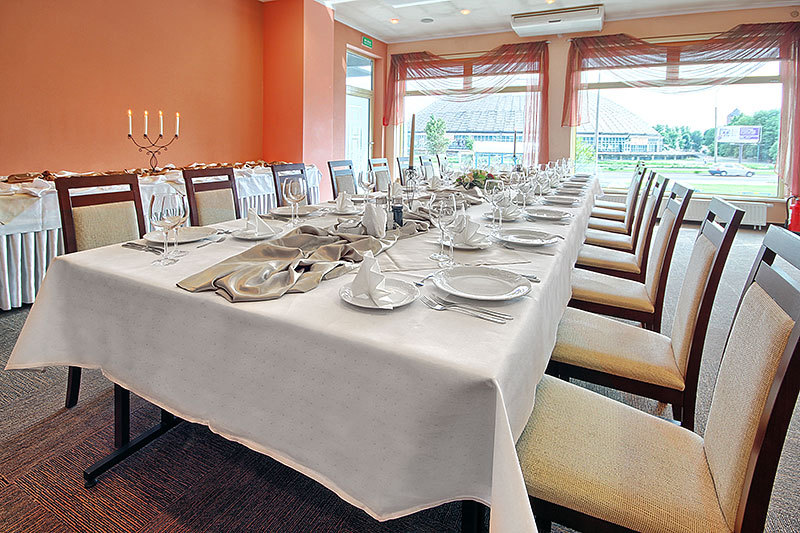
The width and height of the screenshot is (800, 533). In order to click on swags in this screenshot , I will do [796, 80], [694, 64], [580, 83], [537, 95], [465, 61], [392, 88].